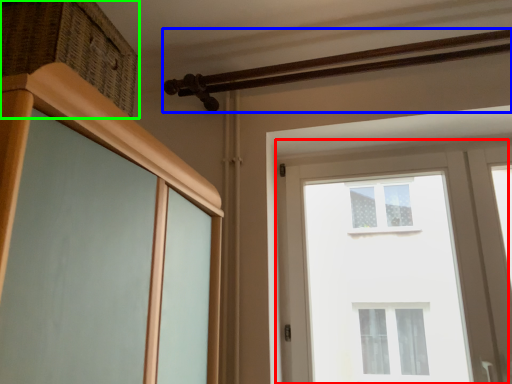
Question: Considering the real-world distances, which object is farthest from window (highlighted by a red box)? rail (highlighted by a blue box) or drawer (highlighted by a green box)?

Choices:
 (A) rail
 (B) drawer

Answer: (B)